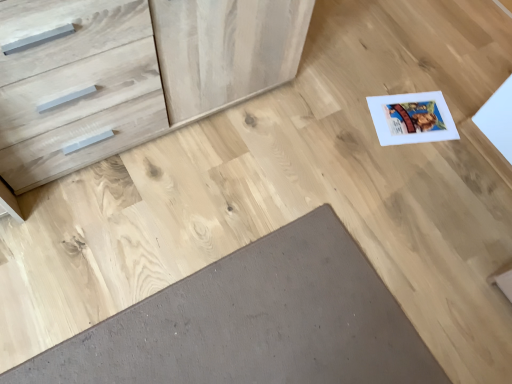
Locate an element on the screen. vacant space in front of natural wood chest of drawers at upper left is located at coordinates (124, 221).